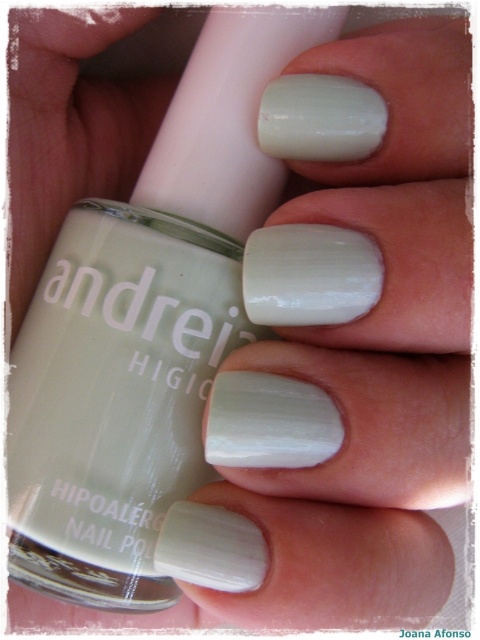
You are a customer at a beauty store holding the matte white nail polish at center and looking at your matte white nails at center. Can you tell me which one has a greater height?

The matte white nail polish at center is not as tall as the matte white nails at center, so the matte white nails at center are taller.

You are a beauty blogger reviewing nail polishes. You have two items in front of you, the matte white nail polish at center and the matte white nails at center. Which item is larger in size?

The matte white nails at center are larger than the matte white nail polish at center.